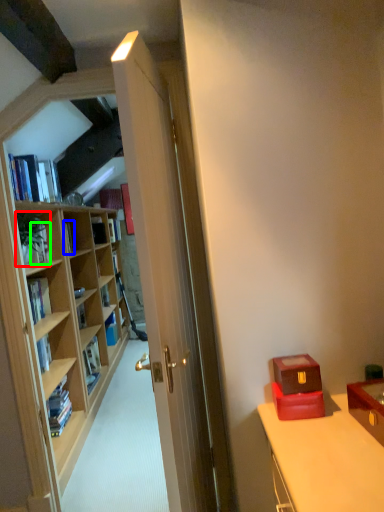
Question: Which is nearer to the houseplant (highlighted by a red box)? book (highlighted by a blue box) or book (highlighted by a green box).

Choices:
 (A) book
 (B) book

Answer: (B)